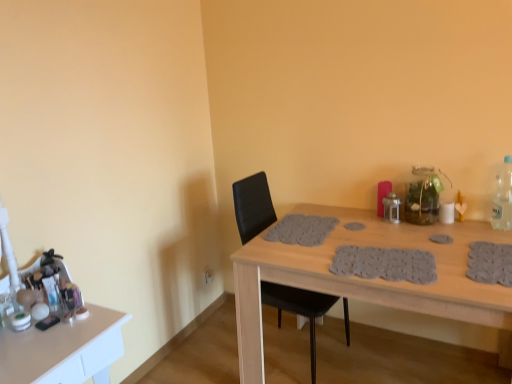
Image resolution: width=512 pixels, height=384 pixels. I want to click on vacant space situated on the left part of black leather chair at center, so click(x=211, y=351).